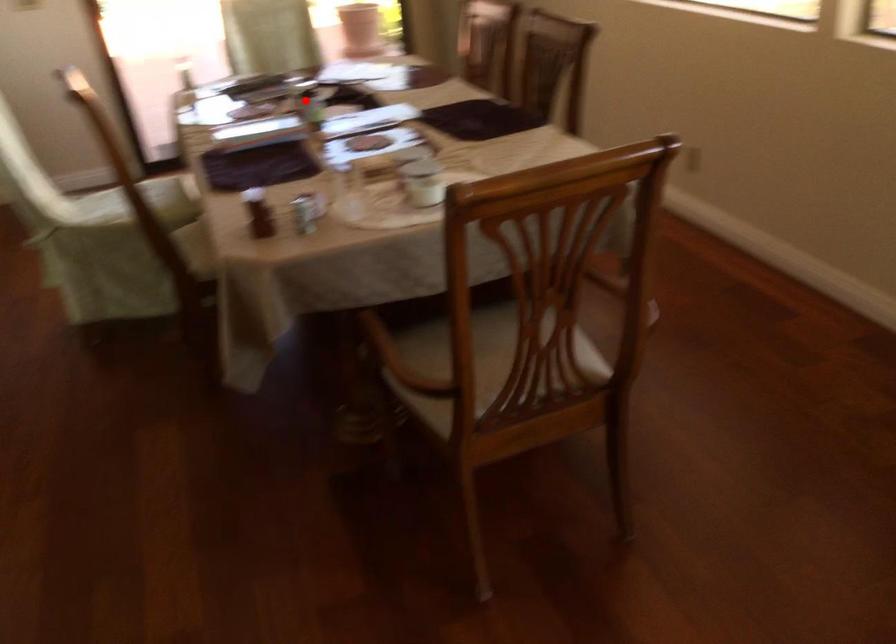
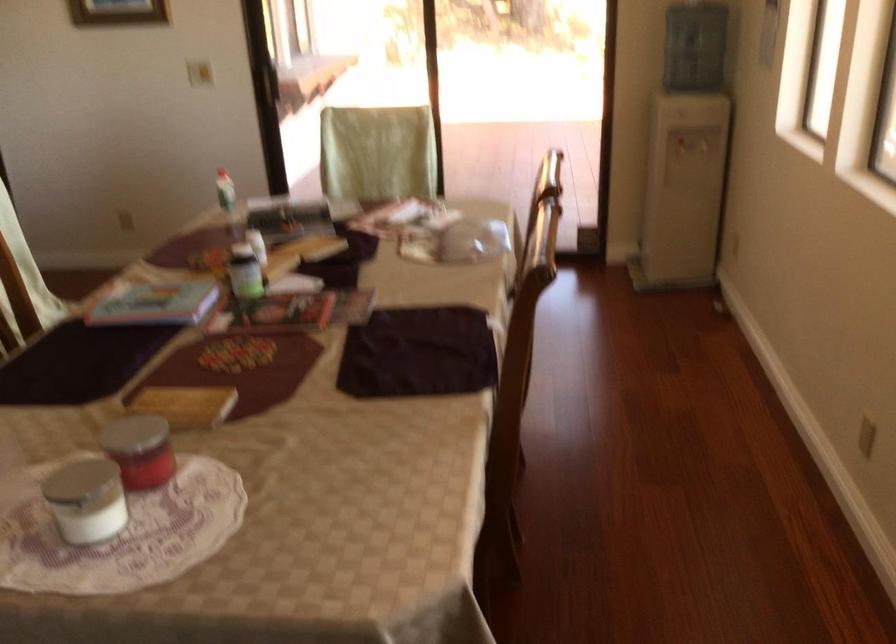
Find the pixel in the second image that matches the highlighted location in the first image.

(245, 272)